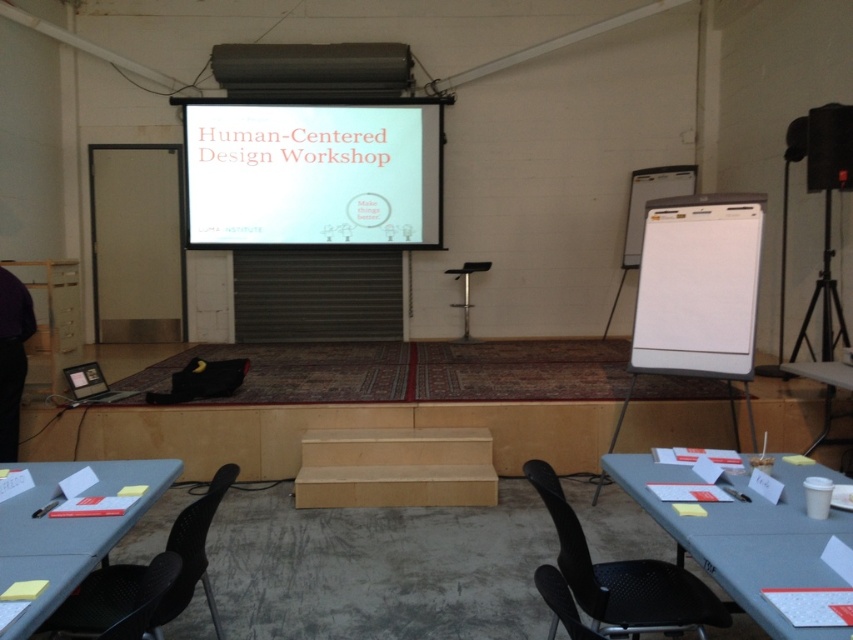
In the scene shown: You are setting up chairs for an event and need to place them in front of the gray fabric table at lower right and the white plastic table at lower right. Since you want the chairs to be at the same level, which table should you place closer to the chairs?

The gray fabric table at lower right has a lesser height compared to the white plastic table at lower right, so you should place the gray fabric table at lower right closer to the chairs to ensure both tables are at the same level.

You are setting up for a workshop and need to place a large banner that requires a space of 1 meter in width. The banner must be placed between the matte gray table at lower left and the stage. Is there enough space between them to accommodate the banner?

The matte gray table at lower left is located at point (68, 531), but without specific distance information between the table and the stage, it is impossible to determine if the banner will fit. Please check the actual measurements or provide additional details about their positions.

You are an attendee at the workshop and need to place your laptop on one of the tables. The laptop is 30 cm wide. Which table, the gray fabric table at lower right or the white plastic table at lower right, can accommodate the laptop without it hanging over the edge?

The gray fabric table at lower right is below the white plastic table at lower right. Since the gray fabric table is positioned lower, it might have a larger surface area to accommodate the 30 cm wide laptop. However, without specific measurements, it is safer to assume the white plastic table at lower right, being higher, could also be suitable. Please check both tables physically.